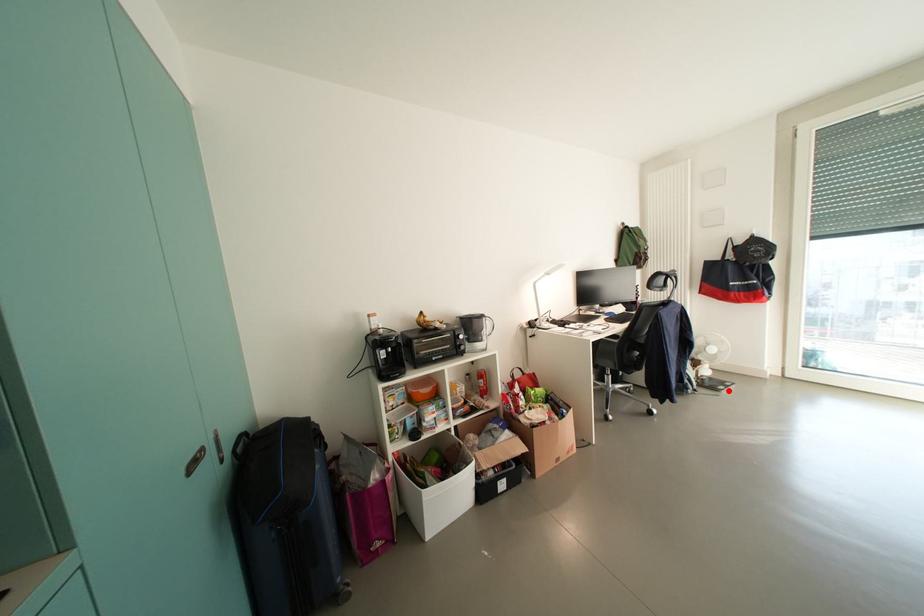
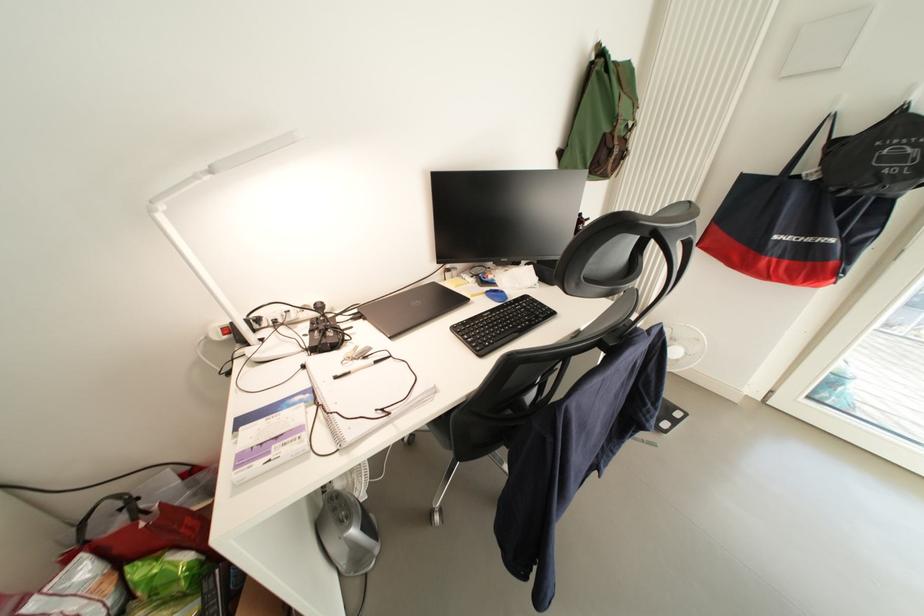
Where in the second image is the point corresponding to the highlighted location from the first image?

(673, 428)